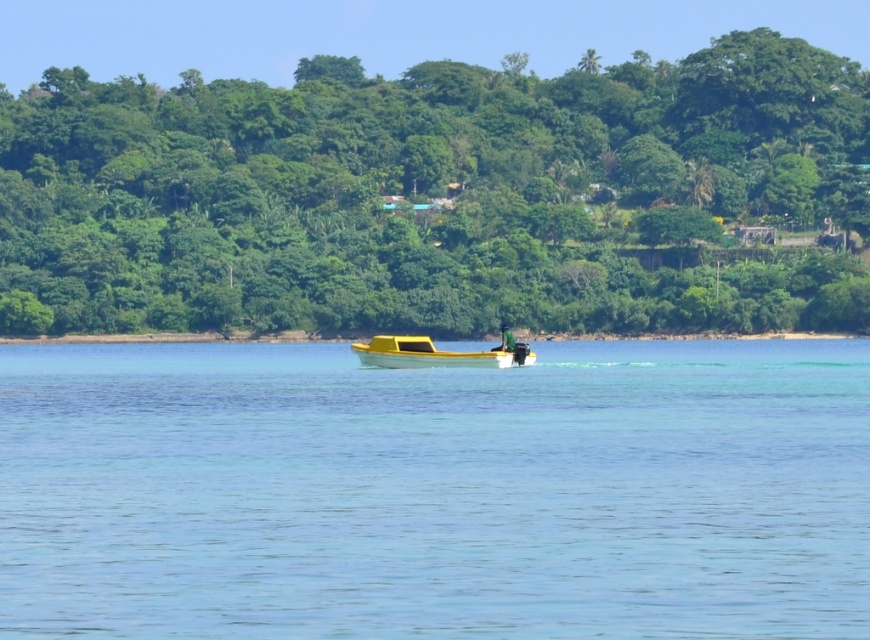
Between clear blue water at center and yellow matte boat at center, which one appears on the left side from the viewer's perspective?

yellow matte boat at center is more to the left.

Who is positioned more to the right, clear blue water at center or yellow matte boat at center?

clear blue water at center

Who is more distant from viewer, (206, 416) or (403, 360)?

The point (403, 360) is more distant.

Where is `clear blue water at center`? clear blue water at center is located at coordinates (435, 492).

In the scene shown: Which of these two, clear blue water at center or green leafy tree at center, stands taller?

Standing taller between the two is green leafy tree at center.

At what (x,y) coordinates should I click in order to perform the action: click on clear blue water at center. Please return your answer as a coordinate pair (x, y). This screenshot has height=640, width=870. Looking at the image, I should click on (435, 492).

This screenshot has width=870, height=640. Identify the location of clear blue water at center. (435, 492).

You are a GUI agent. You are given a task and a screenshot of the screen. Output one action in this format:
    pyautogui.click(x=<x>, y=<y>)
    Task: Click on the clear blue water at center
    The image size is (870, 640).
    Given the screenshot: What is the action you would take?
    pyautogui.click(x=435, y=492)

Is green leafy tree at center below yellow matte boat at center?

Incorrect, green leafy tree at center is not positioned below yellow matte boat at center.

Is green leafy tree at center thinner than yellow matte boat at center?

Incorrect, green leafy tree at center's width is not less than yellow matte boat at center's.

Between point (84, 280) and point (422, 342), which one is positioned in front?

Point (422, 342) is in front.

Identify the location of green leafy tree at center. (435, 195).